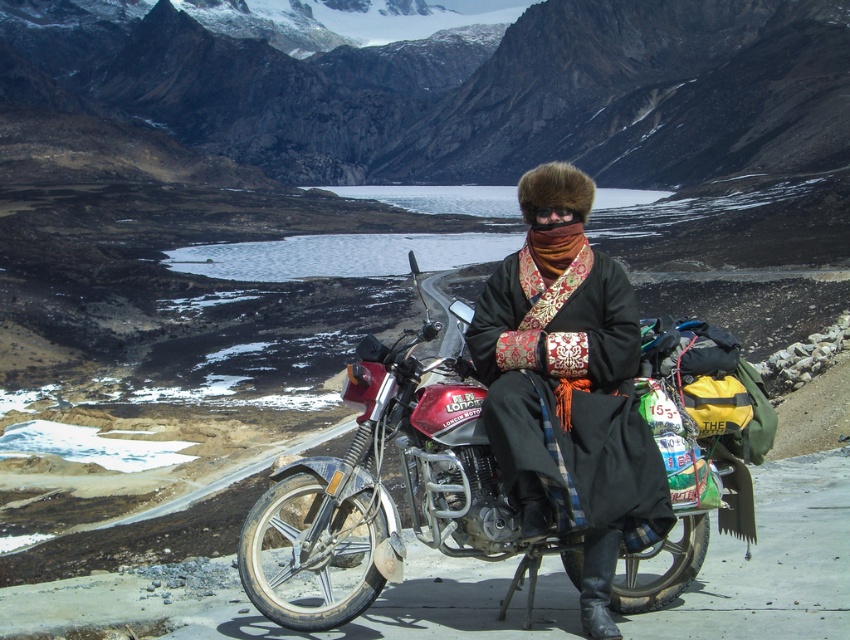
Who is positioned more to the left, metallic red motorcycle at center or black fur hat at center?

Positioned to the left is metallic red motorcycle at center.

Find the location of a particular element. metallic red motorcycle at center is located at coordinates (497, 456).